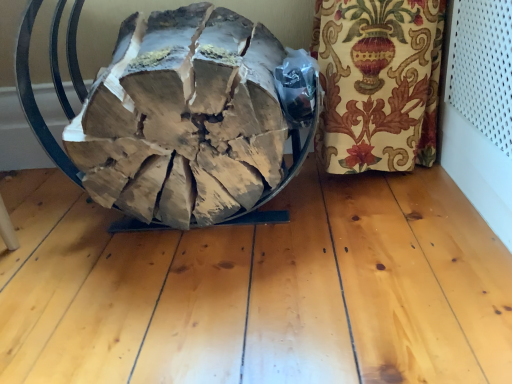
The height and width of the screenshot is (384, 512). What do you see at coordinates (35, 101) in the screenshot?
I see `natural wood firewood at center` at bounding box center [35, 101].

At what (x,y) coordinates should I click in order to perform the action: click on natural wood firewood at center. Please return your answer as a coordinate pair (x, y). This screenshot has height=384, width=512. Looking at the image, I should click on (35, 101).

The height and width of the screenshot is (384, 512). What are the coordinates of `natural wood firewood at center` in the screenshot? It's located at (35, 101).